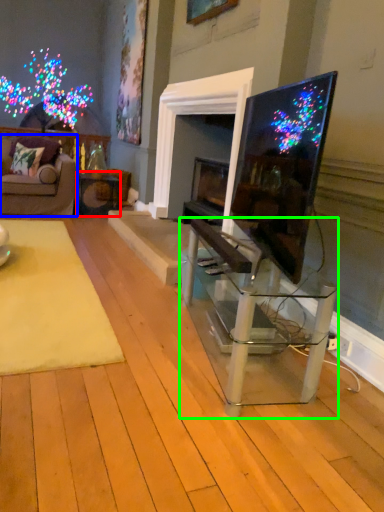
Question: Estimate the real-world distances between objects in this image. Which object is closer to table (highlighted by a red box), studio couch (highlighted by a blue box) or table (highlighted by a green box)?

Choices:
 (A) studio couch
 (B) table

Answer: (A)